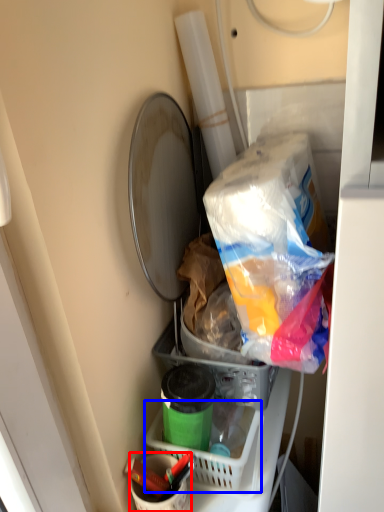
Question: Among these objects, which one is farthest to the camera, bucket (highlighted by a red box) or basket (highlighted by a blue box)?

Choices:
 (A) bucket
 (B) basket

Answer: (B)